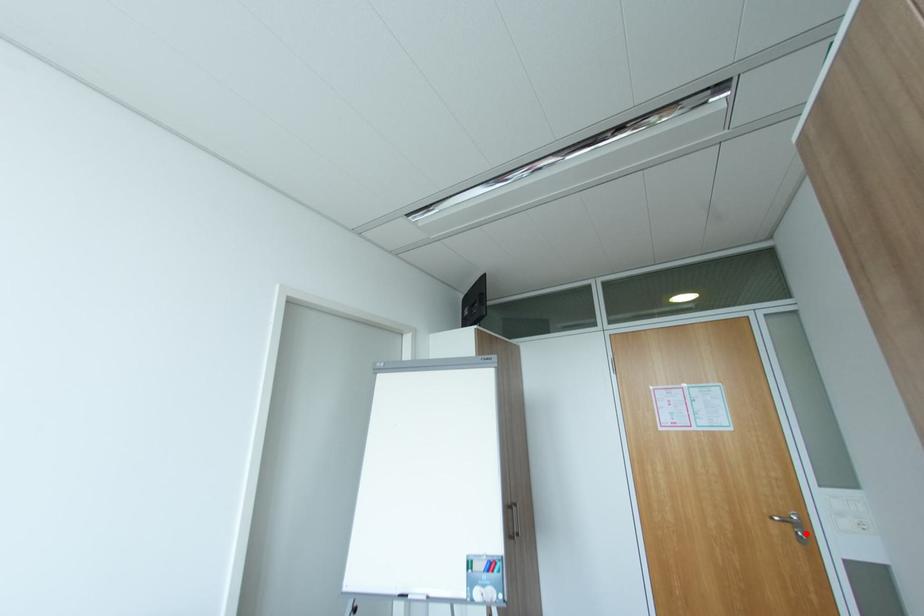
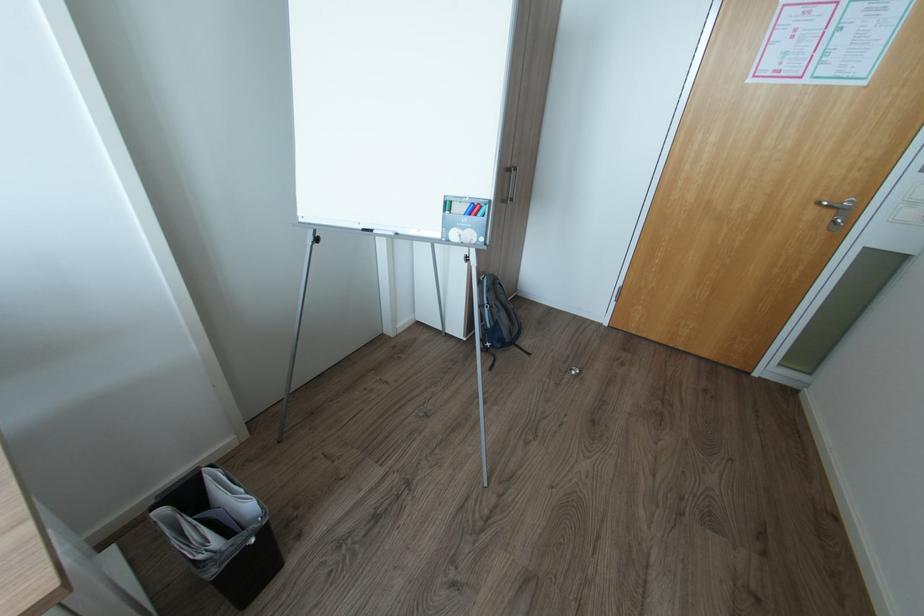
Question: I am providing you with two images of the same scene from different viewpoints. A red point is shown in image1. For the corresponding object point in image2, is it positioned nearer or farther from the camera?

Choices:
 (A) Nearer
 (B) Farther

Answer: (B)